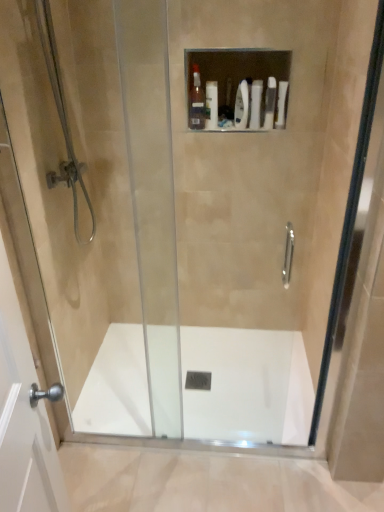
Image resolution: width=384 pixels, height=512 pixels. What do you see at coordinates (100, 200) in the screenshot?
I see `clear glass shower door at left` at bounding box center [100, 200].

At what (x,y) coordinates should I click in order to perform the action: click on clear glass shower door at left. Please return your answer as a coordinate pair (x, y). The image size is (384, 512). Looking at the image, I should click on (100, 200).

Image resolution: width=384 pixels, height=512 pixels. Identify the location of clear glass shower door at left. (100, 200).